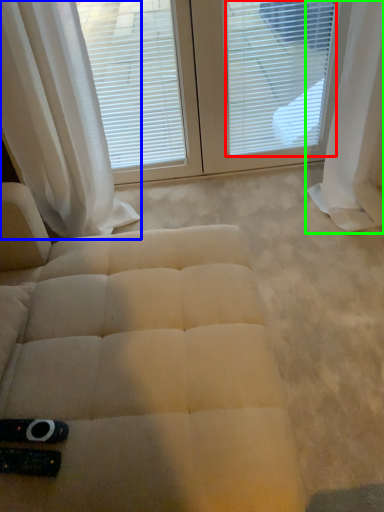
Question: Considering the real-world distances, which object is closest to blind (highlighted by a red box)? curtain (highlighted by a blue box) or curtain (highlighted by a green box).

Choices:
 (A) curtain
 (B) curtain

Answer: (B)